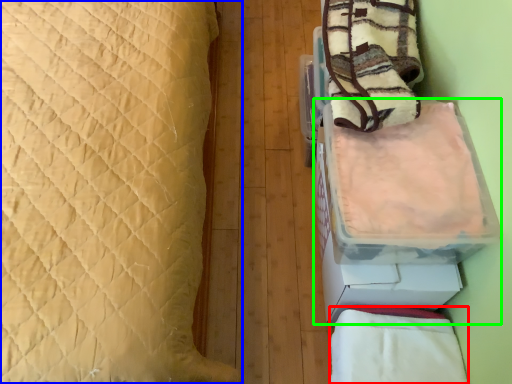
Question: Estimate the real-world distances between objects in this image. Which object is closer to blanket (highlighted by a red box), bed (highlighted by a blue box) or cardboard box (highlighted by a green box)?

Choices:
 (A) bed
 (B) cardboard box

Answer: (B)